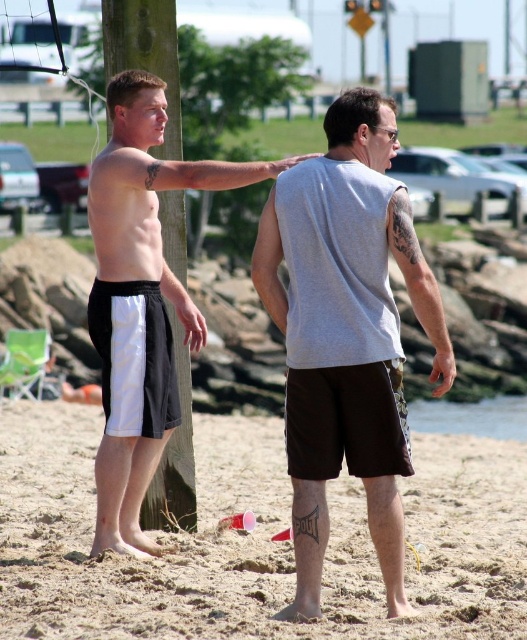
Is gray matte tank top at center smaller than black matte shorts at left?

Correct, gray matte tank top at center occupies less space than black matte shorts at left.

Find the location of a particular element. gray matte tank top at center is located at coordinates (346, 332).

Identify the location of gray matte tank top at center. This screenshot has width=527, height=640. (346, 332).

Based on the photo, does sandy beach at lower center appear under black matte shorts at left?

Yes, sandy beach at lower center is below black matte shorts at left.

Is point (17, 490) closer to viewer compared to point (148, 298)?

No, (17, 490) is further to viewer.

Between point (45, 413) and point (102, 468), which one is positioned behind?

The point (45, 413) is behind.

Identify the location of sandy beach at lower center. (255, 540).

Is sandy beach at lower center below gray matte tank top at center?

Indeed, sandy beach at lower center is positioned under gray matte tank top at center.

Is sandy beach at lower center above gray matte tank top at center?

Actually, sandy beach at lower center is below gray matte tank top at center.

Is point (203, 568) in front of point (395, 552)?

No, (203, 568) is behind (395, 552).

This screenshot has width=527, height=640. In order to click on sandy beach at lower center in this screenshot , I will do `click(255, 540)`.